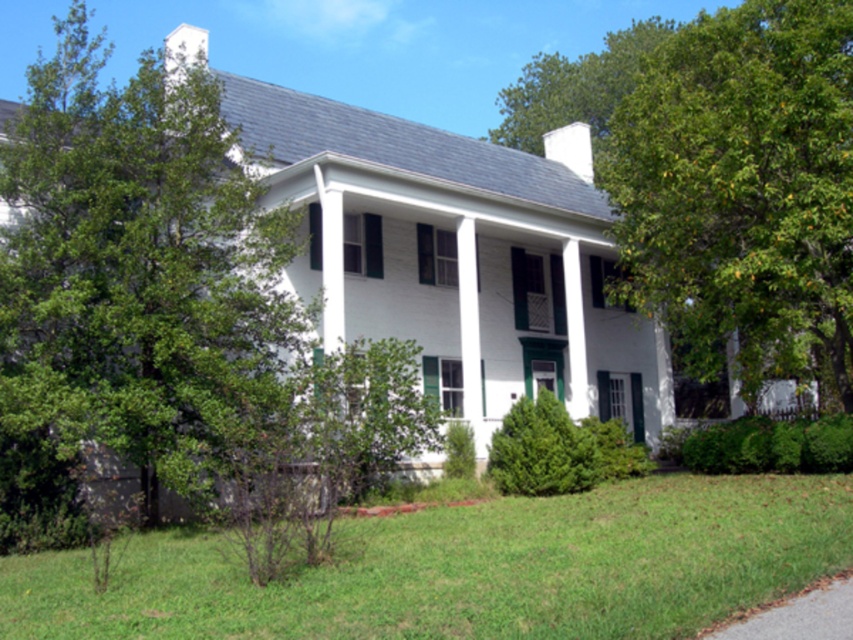
You are standing in front of the two story white house and want to determine the relative positions of two points marked on the facade. The first point is at coordinate point (32, 380) and the second is at point (746, 570). Which point is closer to you?

Point (32, 380) is closer to you because it is further to the viewer than point (746, 570).